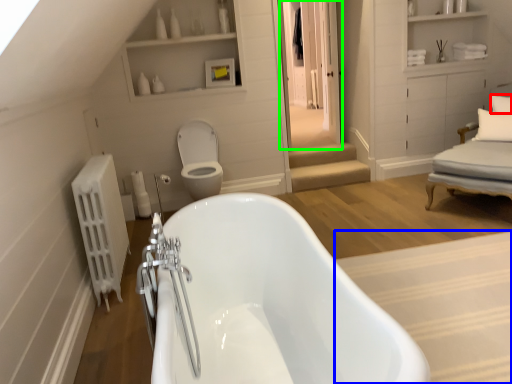
Question: Estimate the real-world distances between objects in this image. Which object is closer to pillow (highlighted by a red box), plain (highlighted by a blue box) or glass door (highlighted by a green box)?

Choices:
 (A) plain
 (B) glass door

Answer: (B)